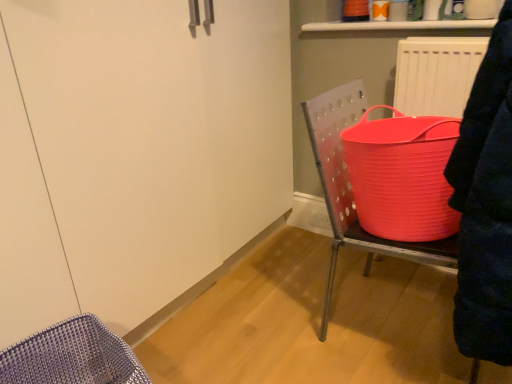
Question: Is matte white radiator at upper right further to the viewer compared to rubberized plastic bucket at right?

Choices:
 (A) yes
 (B) no

Answer: (A)

Question: Would you say matte white radiator at upper right is a long distance from rubberized plastic bucket at right?

Choices:
 (A) yes
 (B) no

Answer: (B)

Question: Is rubberized plastic bucket at right a part of matte white radiator at upper right?

Choices:
 (A) no
 (B) yes

Answer: (A)

Question: From a real-world perspective, is matte white radiator at upper right below rubberized plastic bucket at right?

Choices:
 (A) no
 (B) yes

Answer: (A)

Question: From a real-world perspective, is matte white radiator at upper right over rubberized plastic bucket at right?

Choices:
 (A) yes
 (B) no

Answer: (A)

Question: Does matte white radiator at upper right appear on the right side of rubberized plastic bucket at right?

Choices:
 (A) no
 (B) yes

Answer: (B)

Question: Is rubberized plastic bucket at right turned away from matte white radiator at upper right?

Choices:
 (A) no
 (B) yes

Answer: (B)

Question: Is rubberized plastic bucket at right positioned behind matte white radiator at upper right?

Choices:
 (A) no
 (B) yes

Answer: (A)

Question: Is rubberized plastic bucket at right surrounding matte white radiator at upper right?

Choices:
 (A) yes
 (B) no

Answer: (B)

Question: From a real-world perspective, is rubberized plastic bucket at right on top of matte white radiator at upper right?

Choices:
 (A) yes
 (B) no

Answer: (B)

Question: From the image's perspective, is rubberized plastic bucket at right located beneath matte white radiator at upper right?

Choices:
 (A) yes
 (B) no

Answer: (A)

Question: Is rubberized plastic bucket at right taller than matte white radiator at upper right?

Choices:
 (A) no
 (B) yes

Answer: (B)

Question: Would you say matte white radiator at upper right is inside or outside rubberized plastic bucket at right?

Choices:
 (A) outside
 (B) inside

Answer: (A)